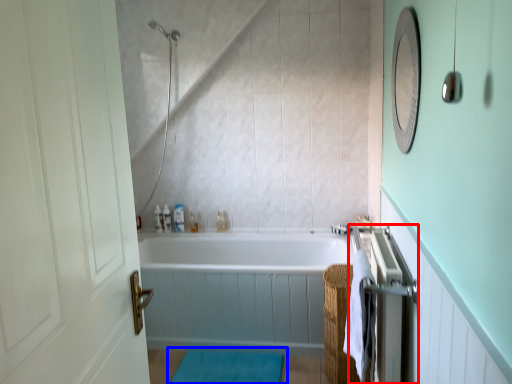
Question: Among these objects, which one is nearest to the camera, closet (highlighted by a red box) or bath mat (highlighted by a blue box)?

Choices:
 (A) closet
 (B) bath mat

Answer: (A)